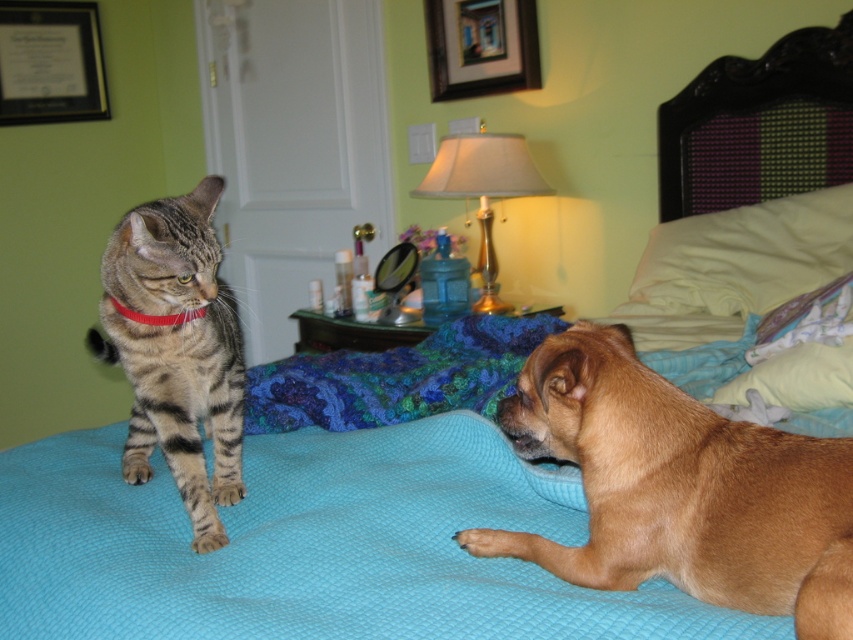
Is point (500, 38) positioned after point (148, 324)?

Yes.

Is wooden framed picture at upper center to the right of red fabric collar at upper left from the viewer's perspective?

Correct, you'll find wooden framed picture at upper center to the right of red fabric collar at upper left.

Does point (502, 20) lie in front of point (109, 301)?

No.

You are a GUI agent. You are given a task and a screenshot of the screen. Output one action in this format:
    pyautogui.click(x=<x>, y=<y>)
    Task: Click on the wooden framed picture at upper center
    This screenshot has height=640, width=853.
    Given the screenshot: What is the action you would take?
    pyautogui.click(x=480, y=45)

Between point (86, 332) and point (827, 275), which one is positioned behind?

The point (86, 332) is behind.

Based on the photo, who is higher up, tabby fur cat at left or white soft pillow at upper right?

white soft pillow at upper right is higher up.

What are the coordinates of `tabby fur cat at left` in the screenshot? It's located at (177, 349).

Can you confirm if brown furry dog at lower right is smaller than gold metallic lampshade at upper center?

Indeed, brown furry dog at lower right has a smaller size compared to gold metallic lampshade at upper center.

Can you confirm if brown furry dog at lower right is bigger than gold metallic lampshade at upper center?

Actually, brown furry dog at lower right might be smaller than gold metallic lampshade at upper center.

The width and height of the screenshot is (853, 640). What do you see at coordinates (680, 488) in the screenshot?
I see `brown furry dog at lower right` at bounding box center [680, 488].

Identify the location of brown furry dog at lower right. This screenshot has height=640, width=853. (680, 488).